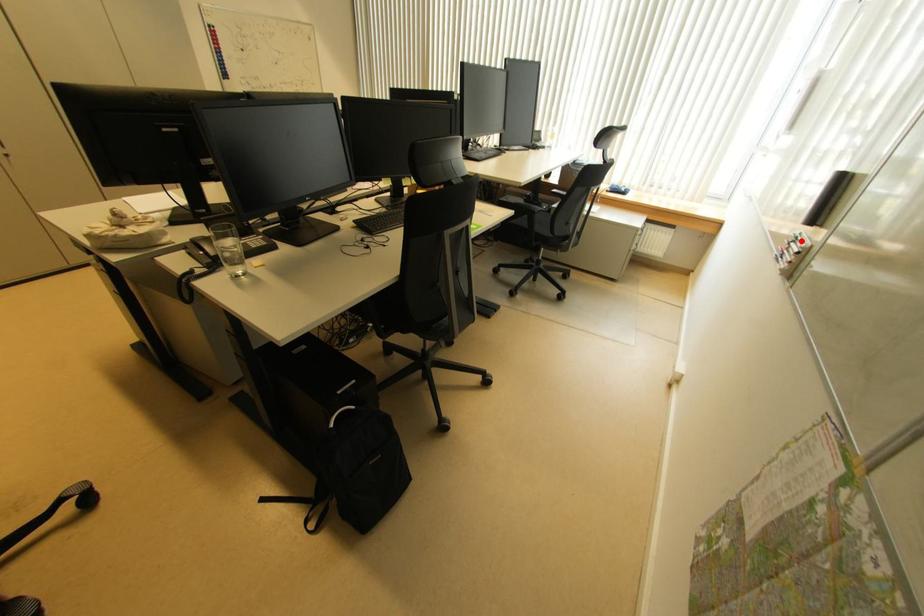
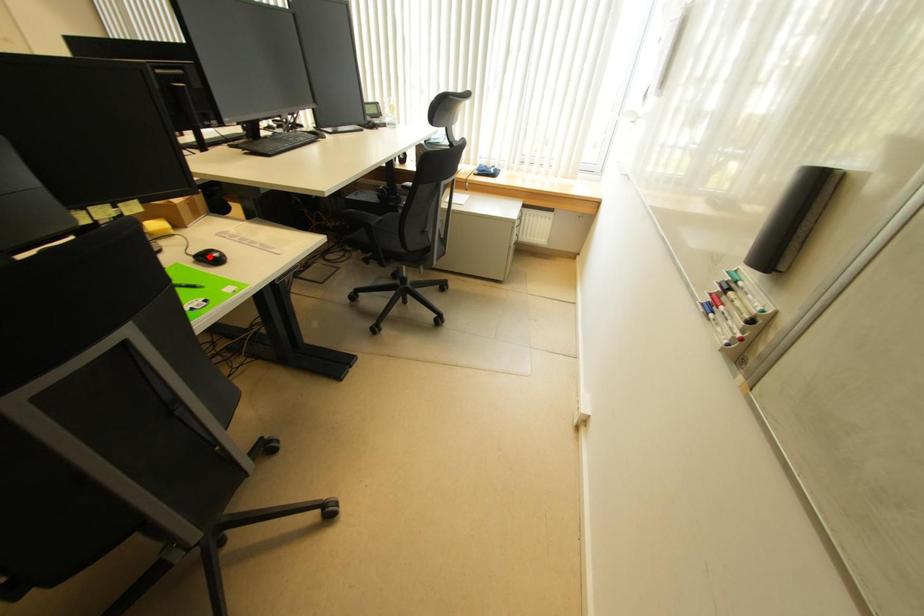
I am providing you with two images of the same scene from different viewpoints. A red point is marked on the first image and another point is marked on the second image. Are the points marked in image1 and image2 representing the same 3D position?

No